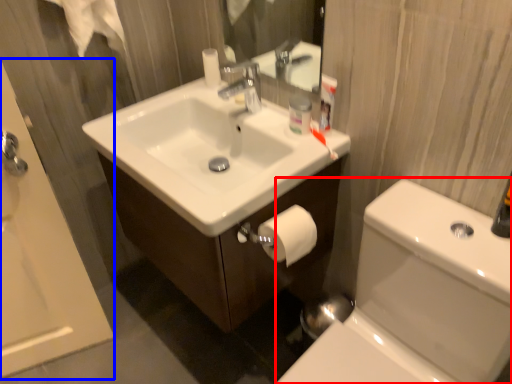
Question: Among these objects, which one is nearest to the camera, toilet bowl (highlighted by a red box) or bath (highlighted by a blue box)?

Choices:
 (A) toilet bowl
 (B) bath

Answer: (A)